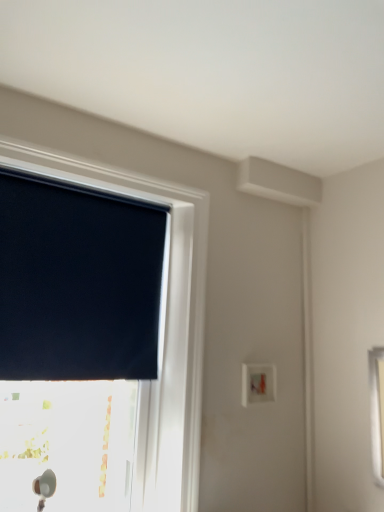
Question: Is dark blue fabric at upper left positioned beyond the bounds of black matte window at upper left?

Choices:
 (A) yes
 (B) no

Answer: (B)

Question: From the image's perspective, is dark blue fabric at upper left located beneath black matte window at upper left?

Choices:
 (A) no
 (B) yes

Answer: (A)

Question: From the image's perspective, would you say dark blue fabric at upper left is positioned over black matte window at upper left?

Choices:
 (A) yes
 (B) no

Answer: (A)

Question: Is the position of dark blue fabric at upper left more distant than that of black matte window at upper left?

Choices:
 (A) no
 (B) yes

Answer: (B)

Question: Is dark blue fabric at upper left smaller than black matte window at upper left?

Choices:
 (A) yes
 (B) no

Answer: (A)

Question: From a real-world perspective, is dark blue fabric at upper left physically located above or below white plastic light switch at center-right?

Choices:
 (A) above
 (B) below

Answer: (A)

Question: From the image's perspective, is dark blue fabric at upper left located above or below white plastic light switch at center-right?

Choices:
 (A) below
 (B) above

Answer: (B)

Question: In terms of height, does dark blue fabric at upper left look taller or shorter compared to white plastic light switch at center-right?

Choices:
 (A) tall
 (B) short

Answer: (A)

Question: Considering the positions of point (97, 354) and point (251, 374), is point (97, 354) closer or farther from the camera than point (251, 374)?

Choices:
 (A) farther
 (B) closer

Answer: (B)

Question: From their relative heights in the image, would you say white plastic light switch at center-right is taller or shorter than black matte window at upper left?

Choices:
 (A) tall
 (B) short

Answer: (B)

Question: From a real-world perspective, is white plastic light switch at center-right above or below black matte window at upper left?

Choices:
 (A) above
 (B) below

Answer: (B)

Question: Is point (251, 369) positioned closer to the camera than point (145, 385)?

Choices:
 (A) farther
 (B) closer

Answer: (A)

Question: Considering the positions of white plastic light switch at center-right and black matte window at upper left in the image, is white plastic light switch at center-right wider or thinner than black matte window at upper left?

Choices:
 (A) thin
 (B) wide

Answer: (A)

Question: Considering the positions of black matte window at upper left and white plastic light switch at center-right in the image, is black matte window at upper left wider or thinner than white plastic light switch at center-right?

Choices:
 (A) thin
 (B) wide

Answer: (B)

Question: Considering their positions, is black matte window at upper left located in front of or behind white plastic light switch at center-right?

Choices:
 (A) front
 (B) behind

Answer: (A)